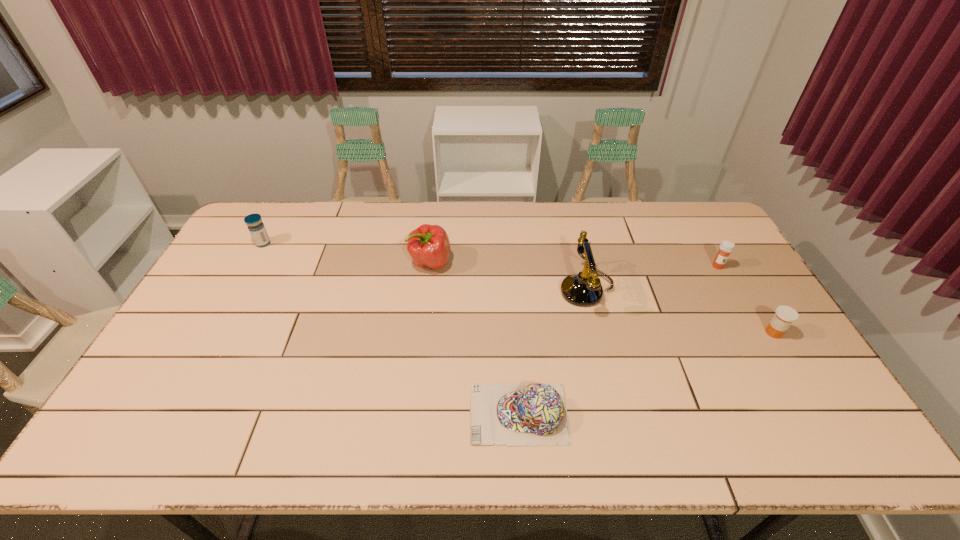
I want to click on telephone, so click(x=582, y=289).

Where is `the third object from right to left`? This screenshot has width=960, height=540. the third object from right to left is located at coordinates [582, 289].

The width and height of the screenshot is (960, 540). I want to click on the fifth object from right to left, so click(429, 246).

Where is `pepper`? pepper is located at coordinates (429, 246).

At what (x,y) coordinates should I click in order to perform the action: click on the farthest object. Please return your answer as a coordinate pair (x, y). Looking at the image, I should click on (256, 227).

Find the location of a particular element. the leftmost medicine is located at coordinates click(256, 227).

The width and height of the screenshot is (960, 540). Find the location of `the second medicine from right to left`. the second medicine from right to left is located at coordinates (726, 247).

Find the location of a particular element. the second object from right to left is located at coordinates (726, 247).

Identify the location of the rightmost medicine. The width and height of the screenshot is (960, 540). (784, 316).

The image size is (960, 540). I want to click on the rightmost object, so click(784, 316).